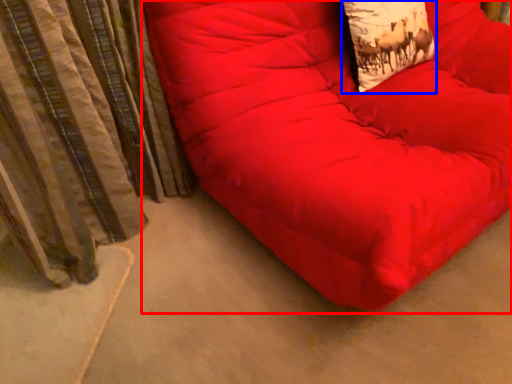
Question: Which of the following is the farthest to the observer, furniture (highlighted by a red box) or throw pillow (highlighted by a blue box)?

Choices:
 (A) furniture
 (B) throw pillow

Answer: (B)